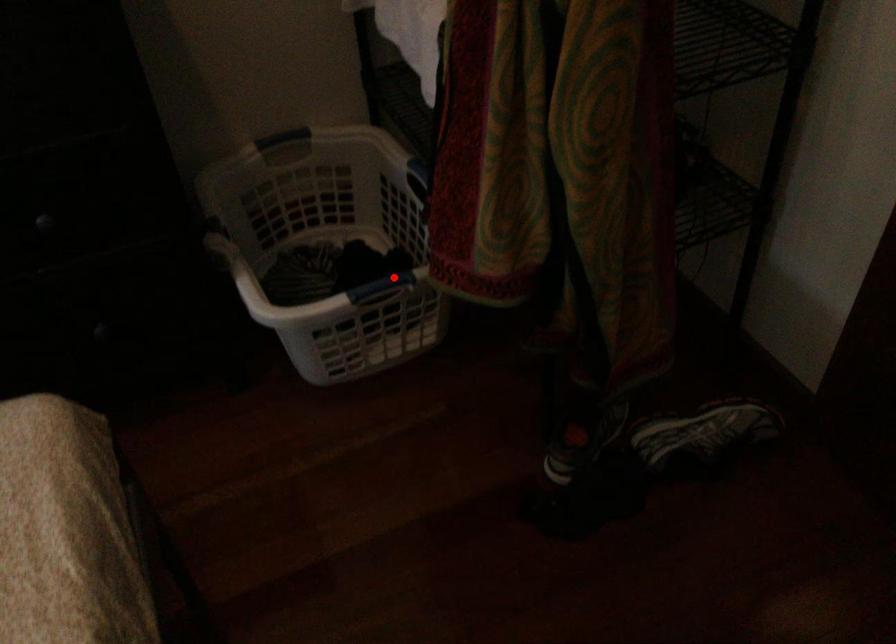
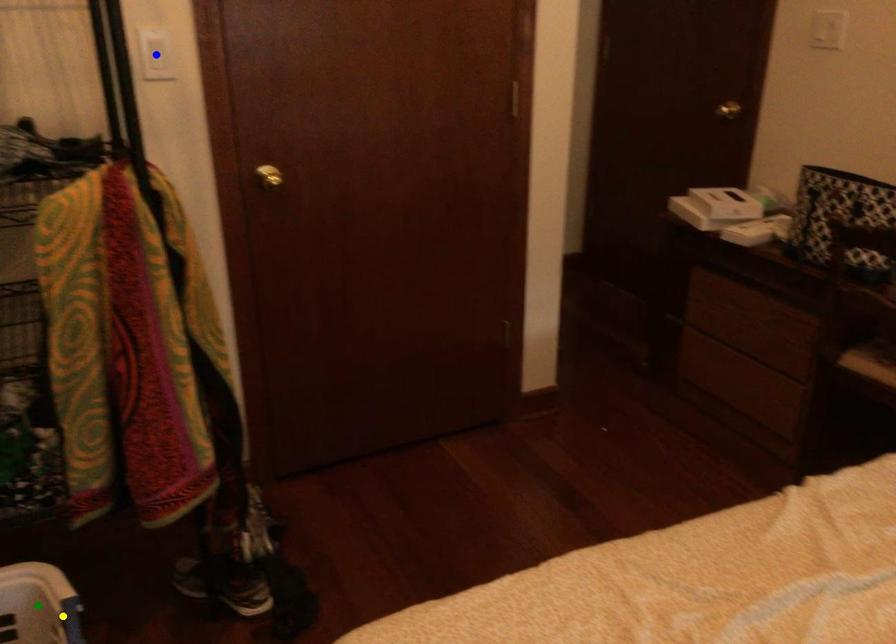
Question: I am providing you with two images of the same scene from different viewpoints. A red point is marked on the first image. You are given multiple points on the second image. Can you choose the point in image 2 that corresponds to the point in image 1?

Choices:
 (A) blue point
 (B) green point
 (C) yellow point

Answer: (C)